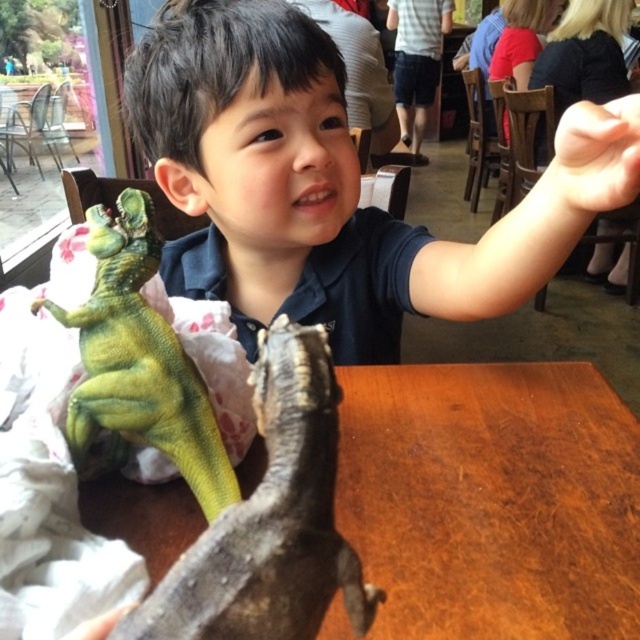
Is leather-like brown lizard at center wider than green matte dinosaur at left?

Incorrect, leather-like brown lizard at center's width does not surpass green matte dinosaur at left's.

Is point (253, 621) closer to camera compared to point (138, 323)?

That is True.

In order to click on leather-like brown lizard at center in this screenshot , I will do `click(272, 518)`.